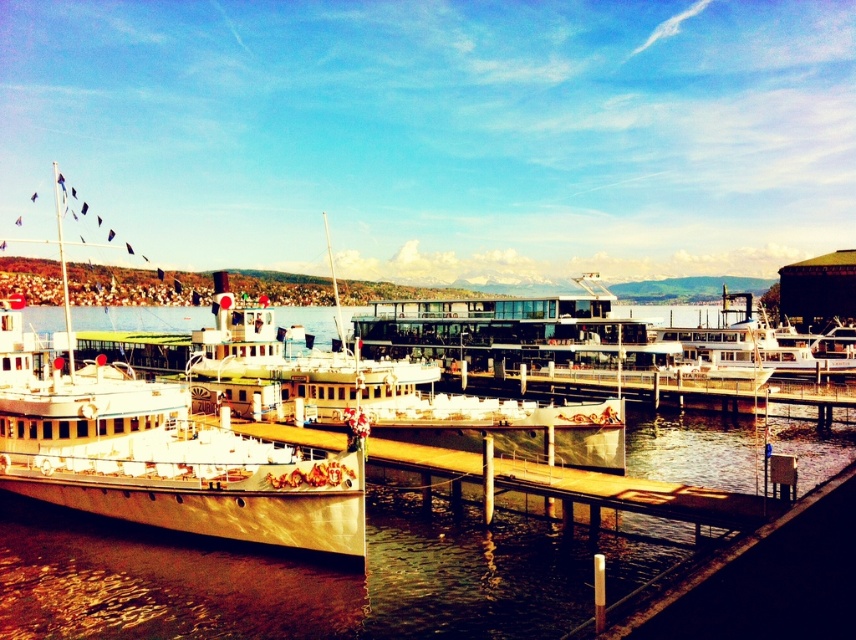
Between metallic water at center and metallic gold boat at left, which one is positioned lower?

metallic gold boat at left is lower down.

Find the location of a particular element. The width and height of the screenshot is (856, 640). metallic water at center is located at coordinates (316, 576).

Find the location of a particular element. This screenshot has height=640, width=856. metallic water at center is located at coordinates (316, 576).